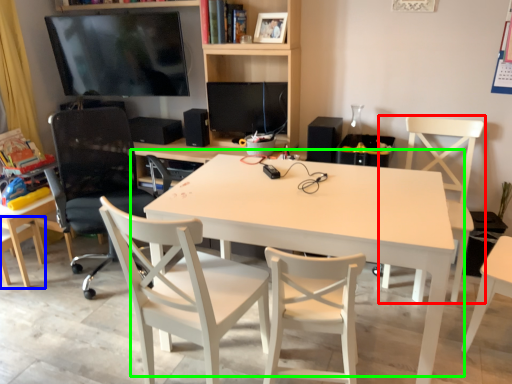
Question: Which object is the closest to the chair (highlighted by a red box)? Choose among these: chair (highlighted by a blue box) or table (highlighted by a green box).

Choices:
 (A) chair
 (B) table

Answer: (B)